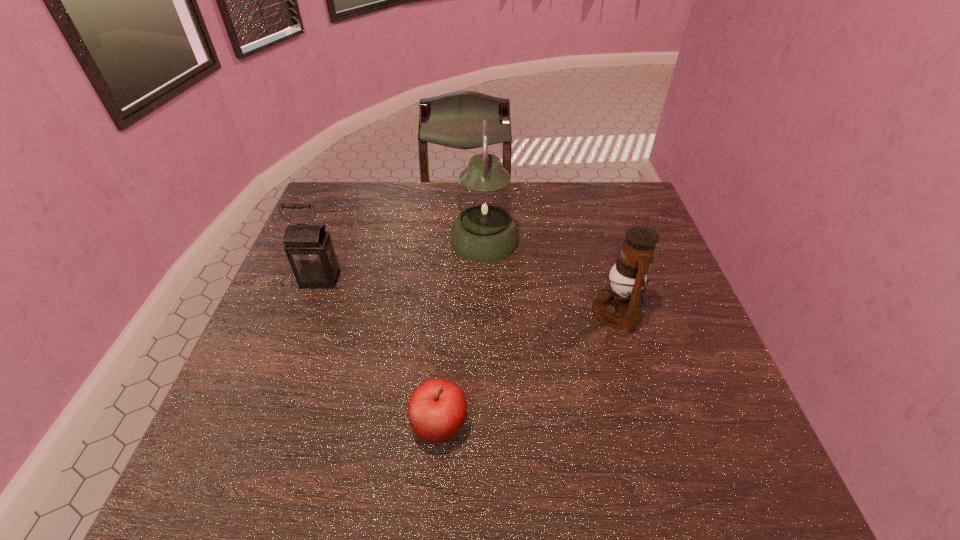
The width and height of the screenshot is (960, 540). What are the coordinates of `vacant area that lies between the apple and the second shortest lantern` in the screenshot? It's located at (528, 368).

Find the location of a particular element. The width and height of the screenshot is (960, 540). vacant region between the nearest object and the leftmost object is located at coordinates (380, 353).

You are a GUI agent. You are given a task and a screenshot of the screen. Output one action in this format:
    pyautogui.click(x=<x>, y=<y>)
    Task: Click on the free space between the rightmost object and the farthest object
    
    Given the screenshot: What is the action you would take?
    pyautogui.click(x=551, y=275)

Find the location of a particular element. This screenshot has width=960, height=540. vacant area that lies between the third tallest object and the second lantern from left to right is located at coordinates (402, 260).

Identify which object is the second nearest to the farthest object. Please provide its 2D coordinates. Your answer should be formatted as a tuple, i.e. [(x, y)], where the tuple contains the x and y coordinates of a point satisfying the conditions above.

[(309, 249)]

Image resolution: width=960 pixels, height=540 pixels. Identify the location of object that is the third closest one to the apple. (484, 231).

Choose which lantern is the second nearest neighbor to the second lantern from right to left. Please provide its 2D coordinates. Your answer should be formatted as a tuple, i.e. [(x, y)], where the tuple contains the x and y coordinates of a point satisfying the conditions above.

[(309, 249)]

Where is `the second closest lantern relative to the shortest lantern`? The image size is (960, 540). the second closest lantern relative to the shortest lantern is located at coordinates (619, 306).

Where is `free space that satisfies the following two spatial constraints: 1. on the back side of the shortest object; 2. on the left side of the farthest lantern`? The height and width of the screenshot is (540, 960). free space that satisfies the following two spatial constraints: 1. on the back side of the shortest object; 2. on the left side of the farthest lantern is located at coordinates (452, 240).

Locate an element on the screen. free point that satisfies the following two spatial constraints: 1. on the front-facing side of the shortest lantern; 2. on the left side of the shortest object is located at coordinates (266, 426).